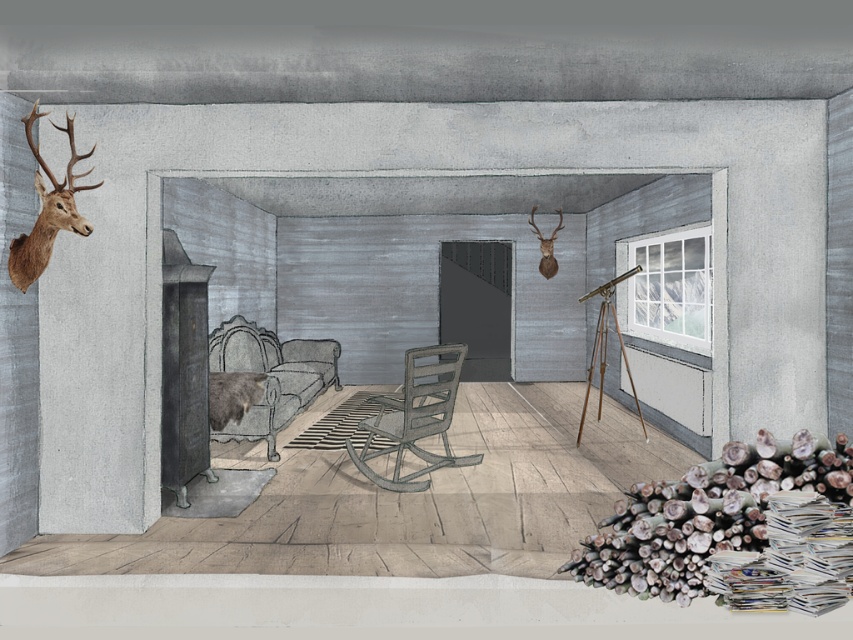
Who is lower down, metallic gray rocking chair at center or brown textured deer head at upper left?

metallic gray rocking chair at center

Does metallic gray rocking chair at center have a lesser height compared to brown textured deer head at upper left?

Incorrect, metallic gray rocking chair at center's height does not fall short of brown textured deer head at upper left's.

Who is more forward, (430, 388) or (48, 214)?

Point (48, 214) is more forward.

Where is `metallic gray rocking chair at center`? The height and width of the screenshot is (640, 853). metallic gray rocking chair at center is located at coordinates (415, 419).

Does fuzzy brown bear at center have a larger size compared to brown matte deer head at upper center?

Actually, fuzzy brown bear at center might be smaller than brown matte deer head at upper center.

Is point (225, 410) farther from viewer compared to point (552, 257)?

No, (225, 410) is in front of (552, 257).

The height and width of the screenshot is (640, 853). Find the location of `fuzzy brown bear at center`. fuzzy brown bear at center is located at coordinates (231, 396).

Is metallic gray rocking chair at center further to camera compared to fuzzy brown bear at center?

No, it is in front of fuzzy brown bear at center.

Is metallic gray rocking chair at center above fuzzy brown bear at center?

Incorrect, metallic gray rocking chair at center is not positioned above fuzzy brown bear at center.

Which is in front, point (447, 404) or point (207, 384)?

Positioned in front is point (447, 404).

This screenshot has width=853, height=640. I want to click on metallic gray rocking chair at center, so click(x=415, y=419).